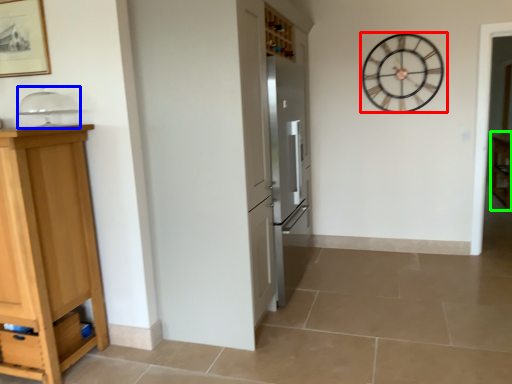
Question: Based on their relative distances, which object is farther from wall clock (highlighted by a red box)? Choose from appliance (highlighted by a blue box) and cabinetry (highlighted by a green box).

Choices:
 (A) appliance
 (B) cabinetry

Answer: (A)